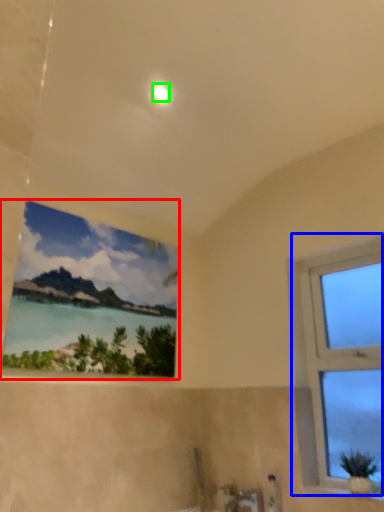
Question: Which is farther away from window (highlighted by a red box)? window (highlighted by a blue box) or light (highlighted by a green box)?

Choices:
 (A) window
 (B) light

Answer: (B)